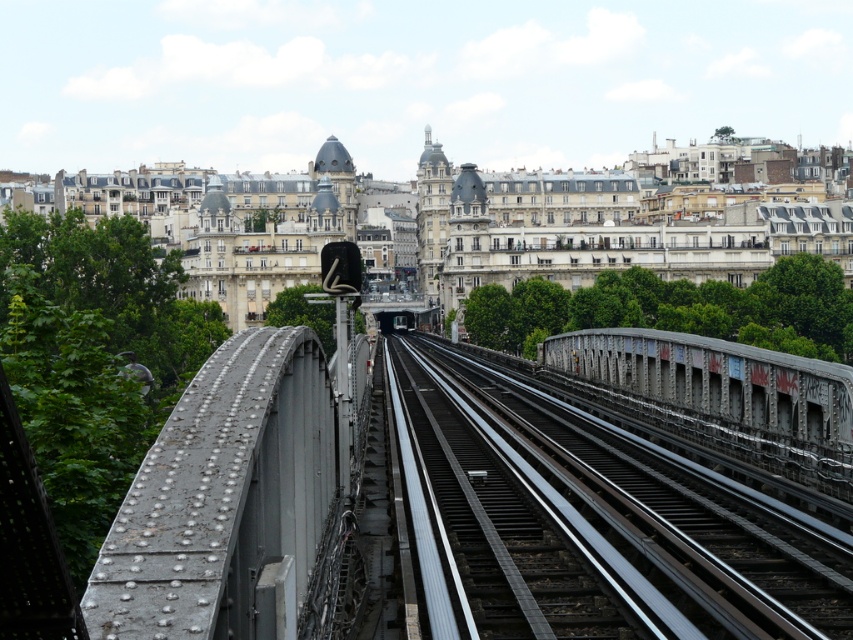
You are standing at the entrance of the tunnel and see two points marked in the image. The first point is at coordinates point (612, 564) and the second is at point (688, 353). Which point is closer to you?

Point (612, 564) is in front of point (688, 353), so the first point is closer to you.